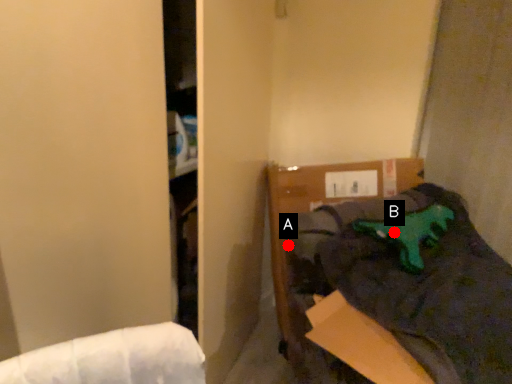
Question: Two points are circled on the image, labeled by A and B beside each circle. Which point is closer to the camera taking this photo?

Choices:
 (A) A is closer
 (B) B is closer

Answer: (B)